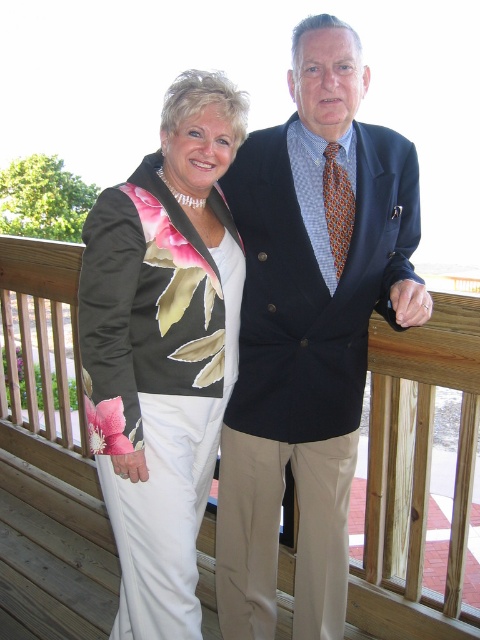
Does floral-patterned fabric at center have a smaller size compared to matte black blazer at center?

Indeed, floral-patterned fabric at center has a smaller size compared to matte black blazer at center.

Based on the photo, does floral-patterned fabric at center come in front of matte black blazer at center?

Yes, floral-patterned fabric at center is closer to the viewer.

Who is more forward, (207, 170) or (377, 417)?

Point (207, 170) is more forward.

At what (x,y) coordinates should I click in order to perform the action: click on floral-patterned fabric at center. Please return your answer as a coordinate pair (x, y). Image resolution: width=480 pixels, height=640 pixels. Looking at the image, I should click on (163, 349).

Is dark blue suit at center wider than matte black blazer at center?

In fact, dark blue suit at center might be narrower than matte black blazer at center.

Does dark blue suit at center have a greater height compared to matte black blazer at center?

Yes, dark blue suit at center is taller than matte black blazer at center.

What do you see at coordinates (309, 330) in the screenshot? I see `dark blue suit at center` at bounding box center [309, 330].

Image resolution: width=480 pixels, height=640 pixels. What are the coordinates of `dark blue suit at center` in the screenshot? It's located at [309, 330].

Is dark blue suit at center positioned behind floral-patterned fabric at center?

Yes, it is.

Can you confirm if dark blue suit at center is positioned to the right of floral-patterned fabric at center?

Correct, you'll find dark blue suit at center to the right of floral-patterned fabric at center.

Which is behind, point (261, 344) or point (113, 312)?

The point (261, 344) is more distant.

Where is `dark blue suit at center`? This screenshot has height=640, width=480. dark blue suit at center is located at coordinates (309, 330).